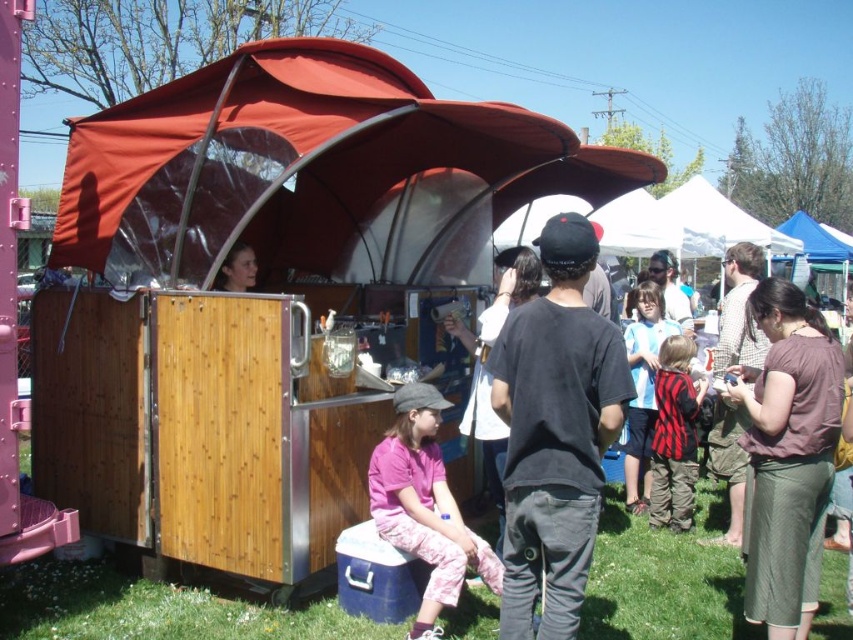
Looking at this image, between pink cotton shirt at lower center and matte black hair at center, which one appears on the left side from the viewer's perspective?

matte black hair at center

Measure the distance between point (485, 541) and camera.

Point (485, 541) and camera are 4.53 meters apart from each other.

Does point (500, 564) lie behind point (238, 289)?

No, (500, 564) is in front of (238, 289).

Image resolution: width=853 pixels, height=640 pixels. What are the coordinates of `pink cotton shirt at lower center` in the screenshot? It's located at [424, 506].

Which is behind, point (421, 547) or point (708, 452)?

The point (708, 452) is behind.

Measure the distance between pink cotton shirt at lower center and camera.

pink cotton shirt at lower center is 12.83 feet from camera.

What are the coordinates of `pink cotton shirt at lower center` in the screenshot? It's located at (424, 506).

From the picture: Does brown fabric skirt at lower right appear on the right side of red and black striped vest at center?

Incorrect, brown fabric skirt at lower right is not on the right side of red and black striped vest at center.

Who is more distant from viewer, (782, 576) or (662, 356)?

The point (662, 356) is more distant.

Who is more forward, [758,416] or [674,529]?

Positioned in front is point [758,416].

Where is `brown fabric skirt at lower right`? The height and width of the screenshot is (640, 853). brown fabric skirt at lower right is located at coordinates (787, 456).